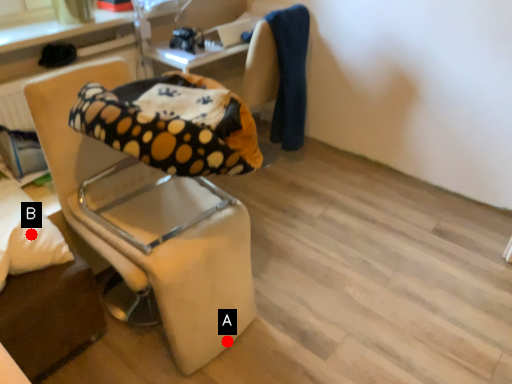
Question: Two points are circled on the image, labeled by A and B beside each circle. Which point is farther to the camera?

Choices:
 (A) A is further
 (B) B is further

Answer: (A)